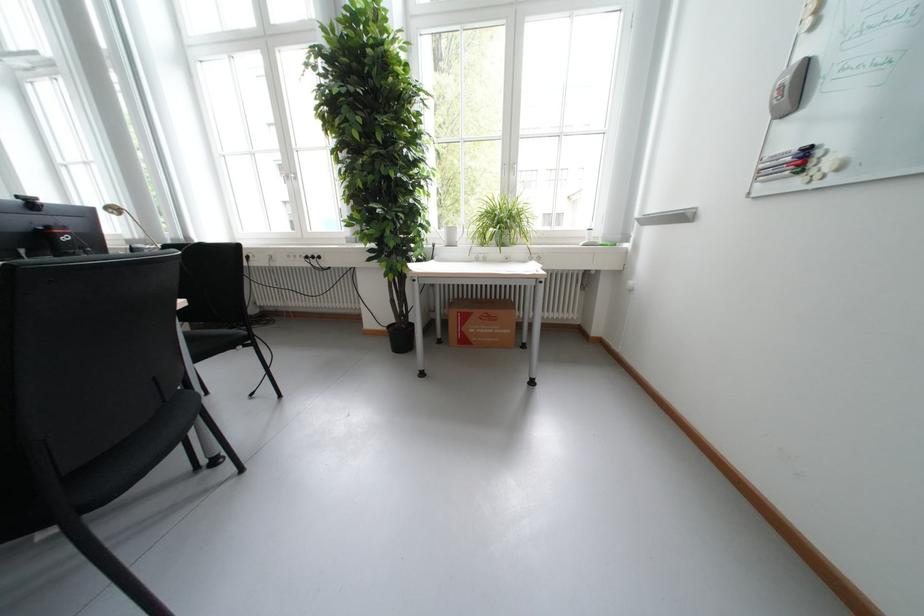
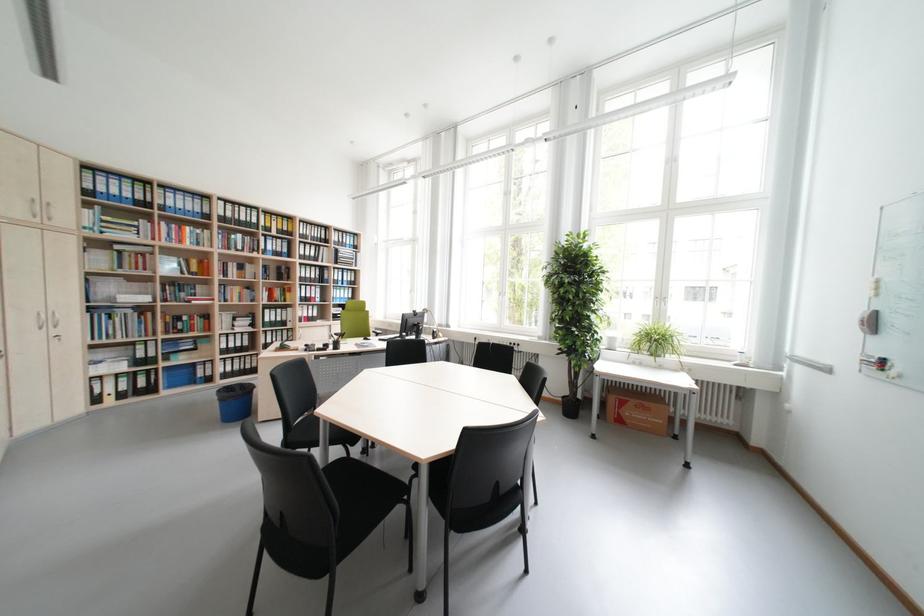
Which direction would the cameraman need to move to produce the second image?

The cameraman moved toward left, backward.